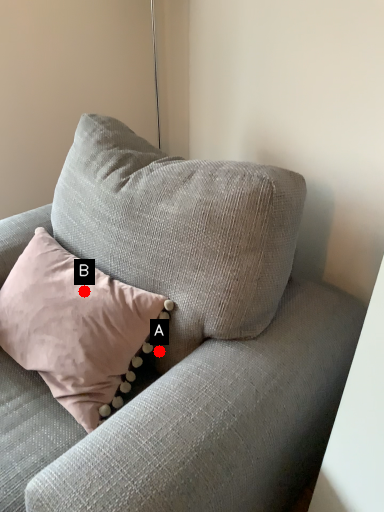
Question: Two points are circled on the image, labeled by A and B beside each circle. Which of the following is the farthest from the observer?

Choices:
 (A) A is further
 (B) B is further

Answer: (A)